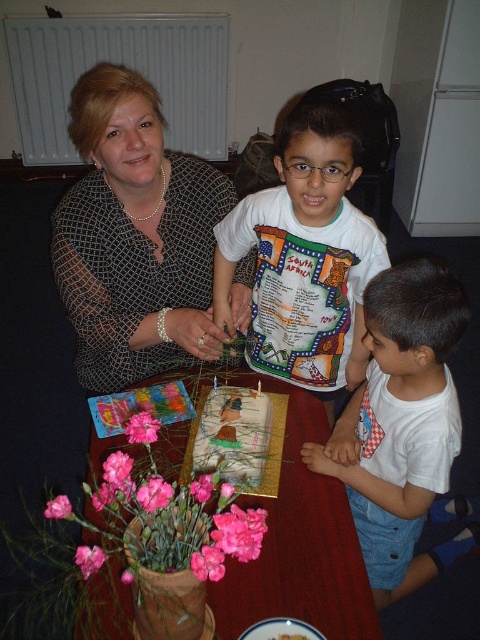
Question: Is the position of white printed shirt at center less distant than that of decorative paper cake at center?

Choices:
 (A) yes
 (B) no

Answer: (B)

Question: Which object is the farthest from the white printed shirt at center?

Choices:
 (A) matte black dress at center
 (B) smooth wooden table at center

Answer: (B)

Question: Which object is positioned farthest from the matte black dress at center?

Choices:
 (A) white printed shirt at center
 (B) white cotton shirt at lower right
 (C) decorative paper cake at center
 (D) smooth wooden table at center

Answer: (B)

Question: Can you confirm if white printed shirt at center is smaller than white cotton shirt at lower right?

Choices:
 (A) yes
 (B) no

Answer: (A)

Question: Which of the following is the closest to the observer?

Choices:
 (A) white cotton shirt at lower right
 (B) decorative paper cake at center

Answer: (B)

Question: Can you confirm if smooth wooden table at center is positioned to the right of decorative paper cake at center?

Choices:
 (A) yes
 (B) no

Answer: (B)